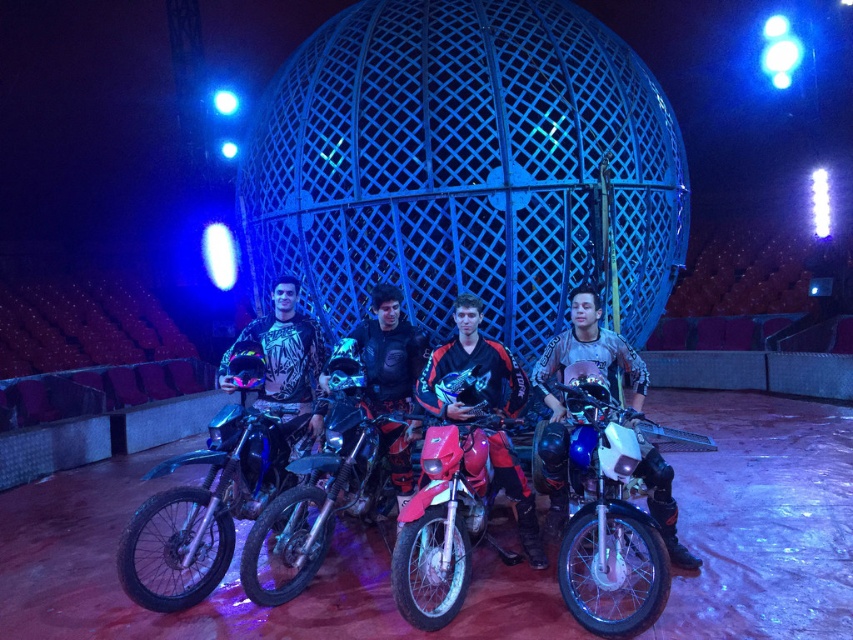
You are a photographer setting up a shoot in the arena. You need to position a narrow camera stand between the red matte dirt bike at center and the red matte motorcycle at center. Which bike should you place the stand closer to, the thinner one or the wider one?

The red matte dirt bike at center is thinner than the red matte motorcycle at center. Therefore, you should place the narrow camera stand closer to the red matte dirt bike at center since it has less width and will provide more space for the stand.

You are a photographer positioned at the back of the arena. You want to take a photo of the black matte jacket at center without the red matte motorcycle at center blocking it. Is this possible based on their positions?

The red matte motorcycle at center is in front of the black matte jacket at center, so it will block the view. Move closer or adjust your angle to avoid the motorcycle.